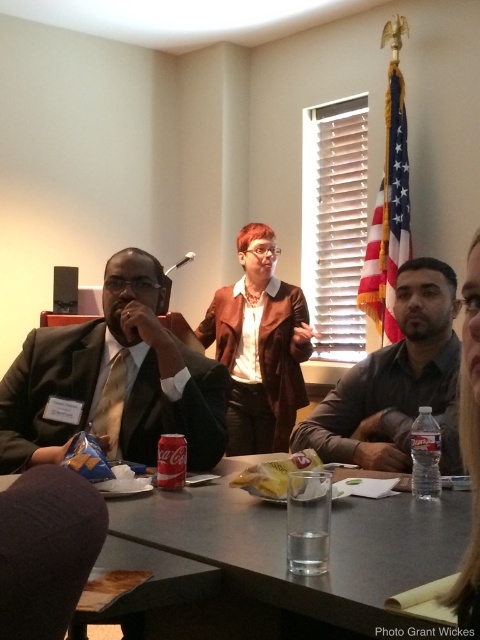
You are a participant in a meeting and need to reach for the matte black laptop at left and the silver metallic microphone at upper center. Which object is closer to you if you are sitting at the position where the laptop and microphone are placed?

The matte black laptop at left is closer to you because it is positioned in front of the silver metallic microphone at upper center.

You are standing at the entrance of the meeting room and see the point marked at coordinates (285,547). Based on the scene description, what object is located at that point?

The point at coordinates (285,547) indicates the smooth gray table at center.

You are a photographer standing at the camera position. You need to take a photo of the matte black laptop at left without moving it. However, your camera can only focus on objects within 3 meters. Will you be able to focus on the laptop?

The matte black laptop at left is 3.75 meters away from the camera, which is beyond the 3 meters focusing range. Therefore, the camera cannot focus on the laptop without moving it.